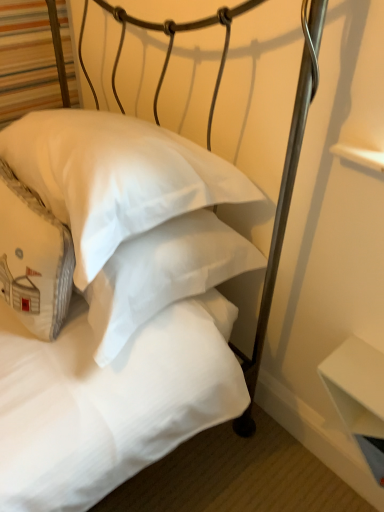
Question: From the image's perspective, relative to white cotton pillow at center, which is the second pillow from right to left, is white matte table at lower right above or below?

Choices:
 (A) above
 (B) below

Answer: (B)

Question: In the image, is white matte table at lower right on the left side or the right side of white cotton pillow at center, which is the second pillow from right to left?

Choices:
 (A) left
 (B) right

Answer: (B)

Question: Estimate the real-world distances between objects in this image. Which object is farther from the white cotton pillow at center, marked as the 1th pillow in a left-to-right arrangement?

Choices:
 (A) white matte pillow at center, placed as the 2th pillow when sorted from left to right
 (B) white matte table at lower right

Answer: (B)

Question: Which is farther from the white matte pillow at center, placed as the 2th pillow when sorted from left to right?

Choices:
 (A) white matte table at lower right
 (B) white cotton pillow at center, marked as the 1th pillow in a left-to-right arrangement

Answer: (A)